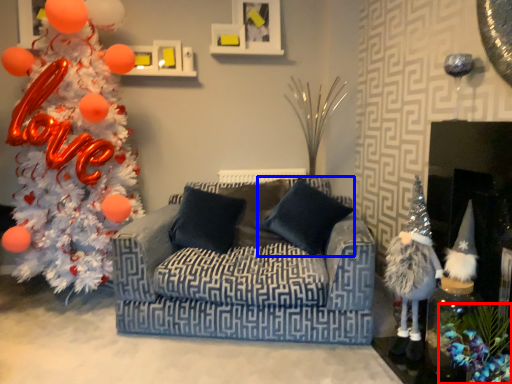
Question: Among these objects, which one is farthest to the camera, christmas decoration (highlighted by a red box) or pillow (highlighted by a blue box)?

Choices:
 (A) christmas decoration
 (B) pillow

Answer: (B)